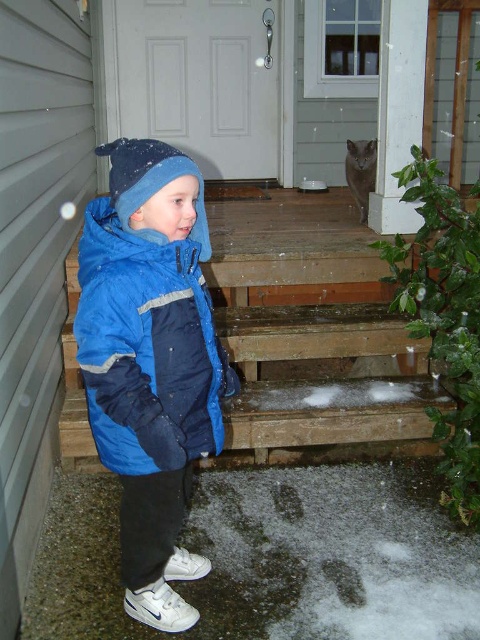
Question: Can you confirm if blue fleece jacket at left is smaller than wooden stairs at lower center?

Choices:
 (A) no
 (B) yes

Answer: (B)

Question: Can you confirm if blue fleece jacket at left is positioned above wooden stairs at lower center?

Choices:
 (A) yes
 (B) no

Answer: (B)

Question: Which point is farther to the camera?

Choices:
 (A) (x=180, y=224)
 (B) (x=328, y=436)

Answer: (B)

Question: Is blue fleece jacket at left positioned at the back of wooden stairs at lower center?

Choices:
 (A) yes
 (B) no

Answer: (B)